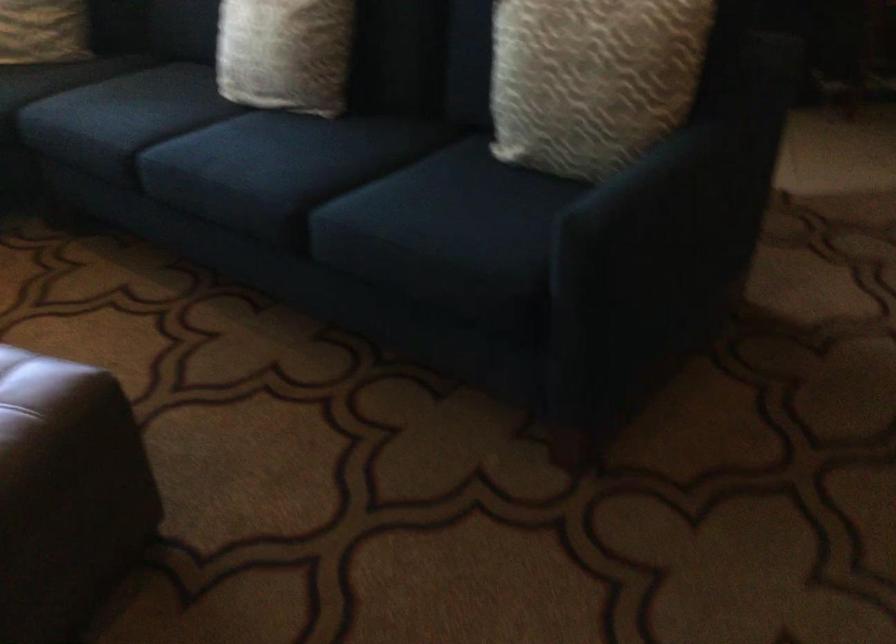
What do you see at coordinates (687, 190) in the screenshot? The width and height of the screenshot is (896, 644). I see `a sofa armrest` at bounding box center [687, 190].